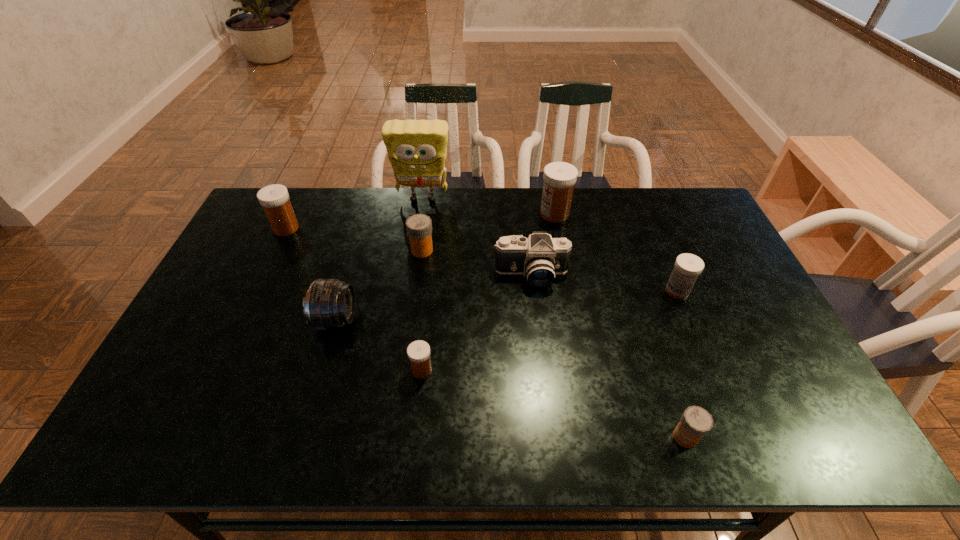
Locate an element on the screen. The height and width of the screenshot is (540, 960). object that is at the far left corner is located at coordinates (274, 199).

The image size is (960, 540). In the image, there is a desktop. Identify the location of vacant space at the far edge. (453, 217).

The image size is (960, 540). I want to click on blank space at the near edge, so click(x=543, y=436).

The height and width of the screenshot is (540, 960). What are the coordinates of `vacant space at the left edge of the desktop` in the screenshot? It's located at (195, 317).

At what (x,y) coordinates should I click in order to perform the action: click on free space at the right edge of the desktop. Please return your answer as a coordinate pair (x, y). Looking at the image, I should click on (705, 230).

The height and width of the screenshot is (540, 960). I want to click on vacant point at the far right corner, so click(x=698, y=221).

Identify the location of vacant point located between the third white medicine from right to left and the farther orange medicine. This screenshot has height=540, width=960. (422, 310).

Locate an element on the screen. The height and width of the screenshot is (540, 960). empty space that is in between the eighth shortest object and the rightmost object is located at coordinates pyautogui.click(x=616, y=253).

The image size is (960, 540). Identify the location of free space between the camera and the fourth farthest medicine. (604, 283).

Image resolution: width=960 pixels, height=540 pixels. What are the coordinates of `free point between the eighth farthest object and the telephoto lens` in the screenshot? It's located at (379, 345).